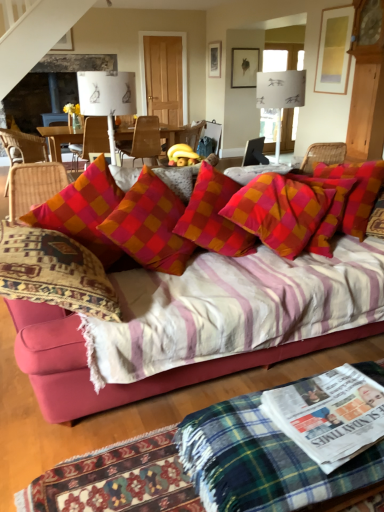
What is the approximate height of wooden chair at center, the 4th chair in the left-to-right sequence?

It is 20.59 inches.

Find the location of `woven wicker chair at left, the 4th chair positioned from the right`. woven wicker chair at left, the 4th chair positioned from the right is located at coordinates (23, 147).

What is the approximate height of white paper lampshade at upper center, which ranks as the first lamp in right-to-left order?

The height of white paper lampshade at upper center, which ranks as the first lamp in right-to-left order, is 24.12 inches.

Measure the distance between point [291,433] and camera.

Point [291,433] is 1.25 meters from camera.

Identify the location of white glossy newspaper at lower right. (329, 415).

Where is `wooden chair at center, the 4th chair in the left-to-right sequence`? The height and width of the screenshot is (512, 384). wooden chair at center, the 4th chair in the left-to-right sequence is located at coordinates (190, 134).

Measure the distance from plush pink couch at center to woven wicker chair at left, the 4th chair positioned from the right.

plush pink couch at center and woven wicker chair at left, the 4th chair positioned from the right, are 5.00 meters apart from each other.

From the image's perspective, is plush pink couch at center located beneath woven wicker chair at left, arranged as the first chair when viewed from the left?

Indeed, from the image's perspective, plush pink couch at center is shown beneath woven wicker chair at left, arranged as the first chair when viewed from the left.

Looking at the image, does plush pink couch at center seem bigger or smaller compared to woven wicker chair at left, the 4th chair positioned from the right?

Considering their sizes, plush pink couch at center takes up more space than woven wicker chair at left, the 4th chair positioned from the right.

Does plush pink couch at center turn towards woven wicker chair at left, arranged as the first chair when viewed from the left?

No, plush pink couch at center is not facing towards woven wicker chair at left, arranged as the first chair when viewed from the left.

Could you tell me if wooden chair at center, the 1th chair viewed from the right, is turned towards white glossy newspaper at lower right?

No.

Based on their sizes in the image, would you say wooden chair at center, the 4th chair in the left-to-right sequence, is bigger or smaller than white glossy newspaper at lower right?

In the image, wooden chair at center, the 4th chair in the left-to-right sequence, appears to be larger than white glossy newspaper at lower right.

In the image, is wooden chair at center, the 1th chair viewed from the right, positioned in front of or behind white glossy newspaper at lower right?

Visually, wooden chair at center, the 1th chair viewed from the right, is located behind white glossy newspaper at lower right.

From their relative heights in the image, would you say wooden chair at center, the 3th chair viewed from the left, is taller or shorter than wooden chair at center, positioned as the 3th chair in right-to-left order?

wooden chair at center, the 3th chair viewed from the left, is taller than wooden chair at center, positioned as the 3th chair in right-to-left order.

Is wooden chair at center, which is counted as the 2th chair, starting from the right, next to wooden chair at center, positioned as the 3th chair in right-to-left order?

wooden chair at center, which is counted as the 2th chair, starting from the right, is not next to wooden chair at center, positioned as the 3th chair in right-to-left order, and they're not touching.

From the image's perspective, between wooden chair at center, which is counted as the 2th chair, starting from the right, and wooden chair at center, positioned as the 3th chair in right-to-left order, who is located below?

wooden chair at center, positioned as the 3th chair in right-to-left order, is shown below in the image.

From the picture: Considering the relative sizes of wooden chair at center, which is counted as the 2th chair, starting from the right, and wooden chair at center, acting as the second chair starting from the left, in the image provided, is wooden chair at center, which is counted as the 2th chair, starting from the right, wider than wooden chair at center, acting as the second chair starting from the left,?

Yes, wooden chair at center, which is counted as the 2th chair, starting from the right, is wider than wooden chair at center, acting as the second chair starting from the left.

Would you say wooden chair at center, the 3th chair viewed from the left, is inside or outside woven wicker chair at left, the 4th chair positioned from the right?

wooden chair at center, the 3th chair viewed from the left, is not enclosed by woven wicker chair at left, the 4th chair positioned from the right.

Which is farther, [153,125] or [0,136]?

Point [153,125]

Does wooden chair at center, which is counted as the 2th chair, starting from the right, have a greater height compared to woven wicker chair at left, the 4th chair positioned from the right?

No.

Which of these two, wooden chair at center, the 3th chair viewed from the left, or woven wicker chair at left, arranged as the first chair when viewed from the left, is smaller?

With smaller size is wooden chair at center, the 3th chair viewed from the left.

Could you tell me if checkered fabric pillow at center, marked as the 2th pillow in a right-to-left arrangement, is turned towards green plaid blanket at lower center?

Yes, checkered fabric pillow at center, marked as the 2th pillow in a right-to-left arrangement, is turned towards green plaid blanket at lower center.

Is point (295, 239) behind point (217, 450)?

That is True.

Based on the photo, from the image's perspective, which is above, white paper lampshade at upper center, the 2th lamp positioned from the left, or wooden chair at center, the 4th chair in the left-to-right sequence?

wooden chair at center, the 4th chair in the left-to-right sequence, from the image's perspective.

Is white paper lampshade at upper center, the 2th lamp positioned from the left, touching wooden chair at center, the 4th chair in the left-to-right sequence?

white paper lampshade at upper center, the 2th lamp positioned from the left, is not next to wooden chair at center, the 4th chair in the left-to-right sequence, and they're not touching.

Looking at this image, from their relative heights in the image, would you say white paper lampshade at upper center, the 2th lamp positioned from the left, is taller or shorter than wooden chair at center, the 1th chair viewed from the right?

Clearly, white paper lampshade at upper center, the 2th lamp positioned from the left, is taller compared to wooden chair at center, the 1th chair viewed from the right.

Is white paper lampshade at upper center, the 2th lamp positioned from the left, situated inside wooden chair at center, the 4th chair in the left-to-right sequence, or outside?

white paper lampshade at upper center, the 2th lamp positioned from the left, is located beyond the bounds of wooden chair at center, the 4th chair in the left-to-right sequence.

Could you measure the distance between plush pink couch at center and plaid fabric pillow at center, which appears as the 1th pillow when viewed from the right?

The distance of plush pink couch at center from plaid fabric pillow at center, which appears as the 1th pillow when viewed from the right, is 1.06 meters.

Starting from the plush pink couch at center, which pillow is the 2nd one behind? Please provide its 2D coordinates.

[(356, 191)]

From the image's perspective, is plush pink couch at center above or below plaid fabric pillow at center, which appears as the 1th pillow when viewed from the right?

From the image's perspective, plush pink couch at center appears below plaid fabric pillow at center, which appears as the 1th pillow when viewed from the right.

Is there a large distance between plush pink couch at center and plaid fabric pillow at center, which appears as the 1th pillow when viewed from the right?

That's right, there is a large distance between plush pink couch at center and plaid fabric pillow at center, which appears as the 1th pillow when viewed from the right.

You are a GUI agent. You are given a task and a screenshot of the screen. Output one action in this format:
    pyautogui.click(x=<x>, y=<y>)
    Task: Click on the studio couch located underneath the woven wicker chair at left, arranged as the first chair when viewed from the left (from a real-world perspective)
    
    Given the screenshot: What is the action you would take?
    pyautogui.click(x=124, y=384)

From a real-world perspective, count 2nd chairs upward from the white glossy newspaper at lower right and point to it. Please provide its 2D coordinates.

[(190, 134)]

Looking at this image, considering their positions, is white paper lampshade at upper center, the 2th lamp positioned from the left, positioned further to wooden chair at center, the 1th chair viewed from the right, than plush pink couch at center?

plush pink couch at center is positioned further to the anchor wooden chair at center, the 1th chair viewed from the right.

Based on their spatial positions, is white paper lampshade at upper center, the second lamp in the right-to-left sequence, or green plaid blanket at lower center further from white glossy newspaper at lower right?

The object further to white glossy newspaper at lower right is white paper lampshade at upper center, the second lamp in the right-to-left sequence.

Looking at this image, from the image, which object appears to be nearer to wooden chair at center, the 3th chair viewed from the left, woven wicker chair at left, arranged as the first chair when viewed from the left, or plaid fabric pillow at center, which appears as the 1th pillow when viewed from the right?

Based on the image, woven wicker chair at left, arranged as the first chair when viewed from the left, appears to be nearer to wooden chair at center, the 3th chair viewed from the left.

Which object lies further to the anchor point green plaid blanket at lower center, plaid fabric pillow at center, which appears as the 1th pillow when viewed from the right, or wooden chair at center, which is counted as the 2th chair, starting from the right?

The object further to green plaid blanket at lower center is wooden chair at center, which is counted as the 2th chair, starting from the right.

Which object lies nearer to the anchor point white paper lampshade at upper center, the 2th lamp positioned from the left, woven wicker chair at left, the 4th chair positioned from the right, or wooden chair at center, which is counted as the 2th chair, starting from the right?

wooden chair at center, which is counted as the 2th chair, starting from the right, lies closer to white paper lampshade at upper center, the 2th lamp positioned from the left, than the other object.

Based on their spatial positions, is wooden chair at center, positioned as the 3th chair in right-to-left order, or white paper lampshade at upper center, the 2th lamp positioned from the left, further from plaid fabric pillow at center, the 2th pillow positioned from the left?

wooden chair at center, positioned as the 3th chair in right-to-left order, is further to plaid fabric pillow at center, the 2th pillow positioned from the left.

Estimate the real-world distances between objects in this image. Which object is further from woven wicker chair at left, the 4th chair positioned from the right, wooden chair at center, the 3th chair viewed from the left, or plaid fabric pillow at center, which appears as the 1th pillow when viewed from the right?

plaid fabric pillow at center, which appears as the 1th pillow when viewed from the right, is positioned further to the anchor woven wicker chair at left, the 4th chair positioned from the right.

Considering their positions, is wooden chair at center, the 1th chair viewed from the right, positioned closer to white paper lampshade at upper center, the second lamp in the right-to-left sequence, than white paper lampshade at upper center, the 2th lamp positioned from the left?

The object closer to white paper lampshade at upper center, the second lamp in the right-to-left sequence, is white paper lampshade at upper center, the 2th lamp positioned from the left.

Find the location of a particular element. The width and height of the screenshot is (384, 512). studio couch between white glossy newspaper at lower right and wooden chair at center, the 4th chair in the left-to-right sequence, from front to back is located at coordinates (124, 384).

Where is `magazine situated between white paper lampshade at upper center, placed as the first lamp when sorted from left to right, and plaid fabric pillow at center, which appears as the 1th pillow when viewed from the right, from left to right`? magazine situated between white paper lampshade at upper center, placed as the first lamp when sorted from left to right, and plaid fabric pillow at center, which appears as the 1th pillow when viewed from the right, from left to right is located at coordinates (329, 415).

Locate an element on the screen. The width and height of the screenshot is (384, 512). studio couch between green plaid blanket at lower center and plaid fabric pillow at center, which appears as the 1th pillow when viewed from the right, from front to back is located at coordinates (124, 384).

The image size is (384, 512). Find the location of `lamp that lies between white paper lampshade at upper center, the 2th lamp positioned from the left, and green plaid blanket at lower center from top to bottom`. lamp that lies between white paper lampshade at upper center, the 2th lamp positioned from the left, and green plaid blanket at lower center from top to bottom is located at coordinates (107, 97).